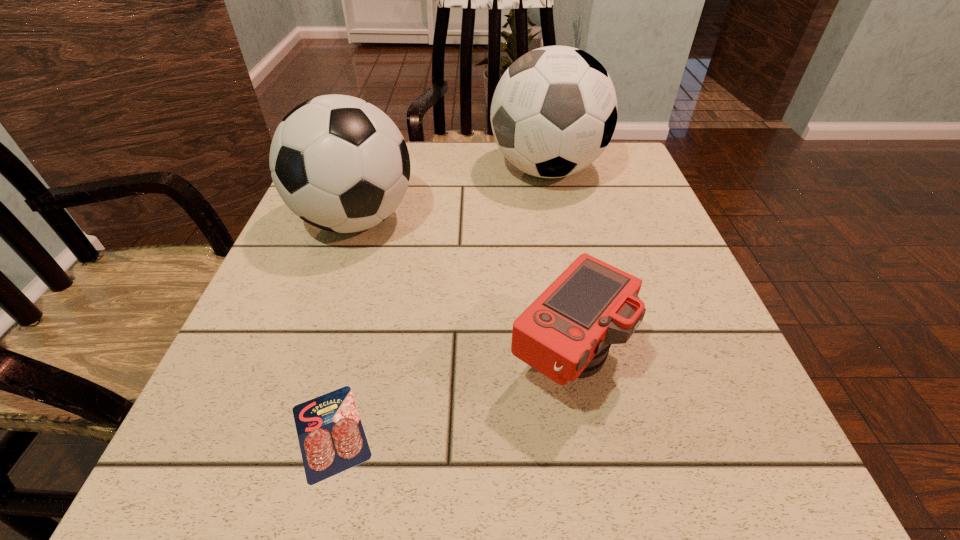
The width and height of the screenshot is (960, 540). I want to click on vacant position at the left edge of the desktop, so [x=348, y=245].

The image size is (960, 540). What are the coordinates of `free space at the right edge` in the screenshot? It's located at click(x=670, y=376).

You are a GUI agent. You are given a task and a screenshot of the screen. Output one action in this format:
    pyautogui.click(x=<x>, y=<y>)
    Task: Click on the vacant area at the near left corner
    The image size is (960, 540).
    Given the screenshot: What is the action you would take?
    pyautogui.click(x=241, y=458)

This screenshot has height=540, width=960. In the image, there is a desktop. Find the location of `vacant space at the far right corner`. vacant space at the far right corner is located at coordinates pos(591,164).

Identify the location of free spot at the near right corner of the desktop. The height and width of the screenshot is (540, 960). (719, 472).

This screenshot has height=540, width=960. I want to click on free space between the right soccer ball and the salami, so click(x=439, y=301).

Locate an element on the screen. free space between the left soccer ball and the shortest object is located at coordinates (343, 326).

The width and height of the screenshot is (960, 540). In order to click on blank region between the second shortest object and the left soccer ball in this screenshot , I will do `click(462, 291)`.

I want to click on unoccupied position between the left soccer ball and the shortest object, so click(x=343, y=326).

You are a GUI agent. You are given a task and a screenshot of the screen. Output one action in this format:
    pyautogui.click(x=<x>, y=<y>)
    Task: Click on the vacant space that's between the second shortest object and the right soccer ball
    The image size is (960, 540).
    Given the screenshot: What is the action you would take?
    (557, 265)